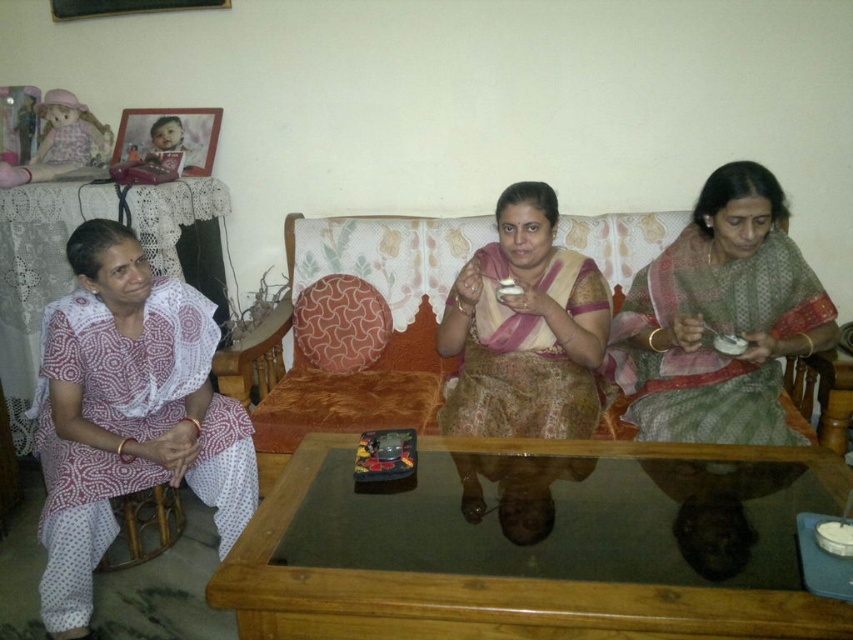
Question: Which point appears farthest from the camera in this image?

Choices:
 (A) (779, 280)
 (B) (500, 218)

Answer: (A)

Question: Which object is positioned closest to the white printed fabric at left?

Choices:
 (A) velvet orange couch at center
 (B) green woven sari at center
 (C) matte pink saree at center

Answer: (A)

Question: Does matte pink saree at center have a smaller size compared to velvet orange couch at center?

Choices:
 (A) no
 (B) yes

Answer: (B)

Question: From the image, what is the correct spatial relationship of white printed fabric at left in relation to velvet orange couch at center?

Choices:
 (A) above
 (B) below

Answer: (B)

Question: Is matte pink saree at center further to the viewer compared to velvet orange couch at center?

Choices:
 (A) no
 (B) yes

Answer: (A)

Question: Which point appears closest to the camera in this image?

Choices:
 (A) (115, 348)
 (B) (701, 257)
 (C) (451, 396)
 (D) (306, 243)

Answer: (A)